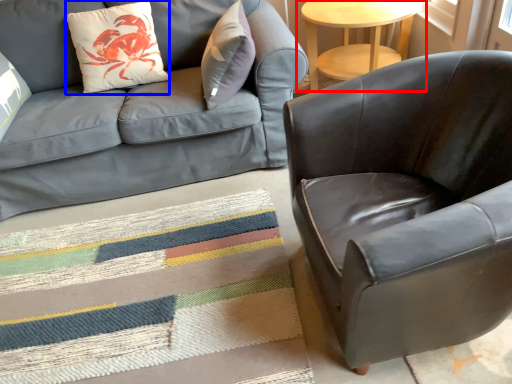
Question: Among these objects, which one is farthest to the camera, table (highlighted by a red box) or throw pillow (highlighted by a blue box)?

Choices:
 (A) table
 (B) throw pillow

Answer: (A)